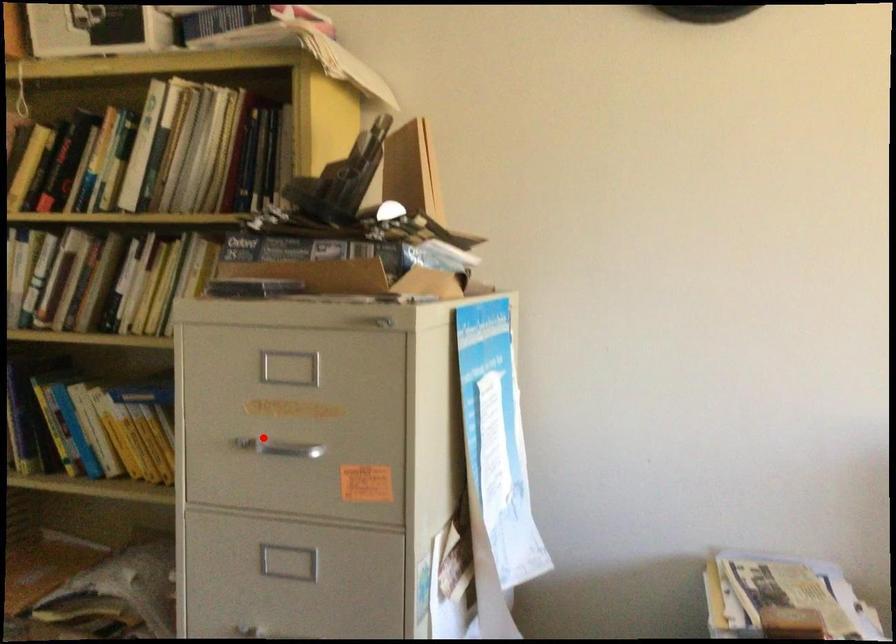
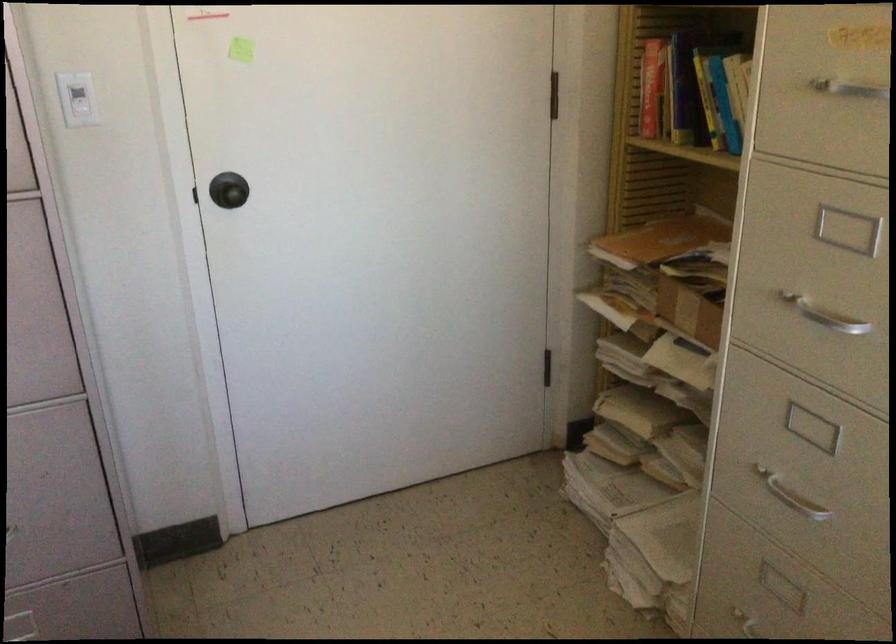
Question: A red point is marked in image1. In image2, is the corresponding 3D point closer to the camera or farther? Reply with the corresponding letter.

Choices:
 (A) The corresponding 3D point is closer.
 (B) The corresponding 3D point is farther.

Answer: (A)